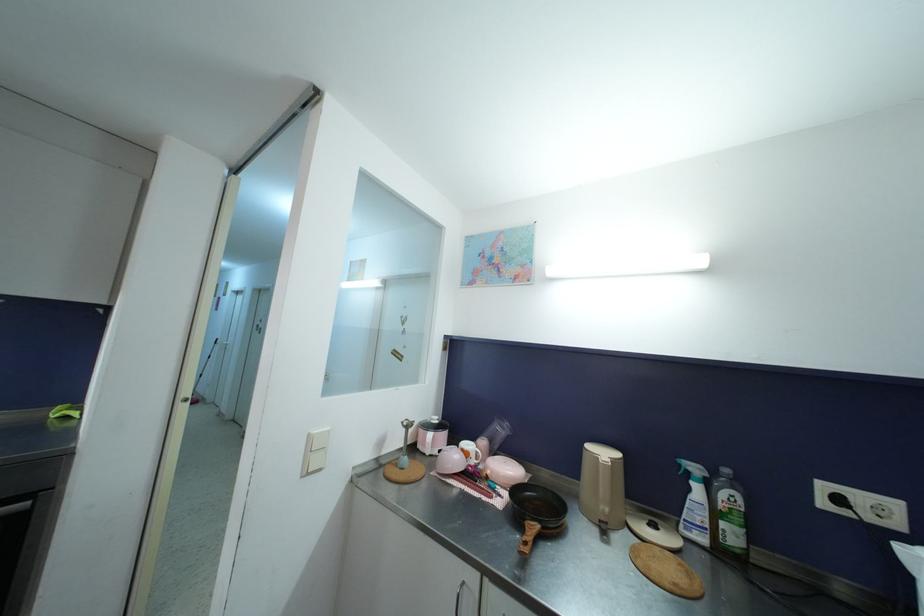
Locate an element on the screen. This screenshot has height=616, width=924. white cabinet handle is located at coordinates (457, 592).